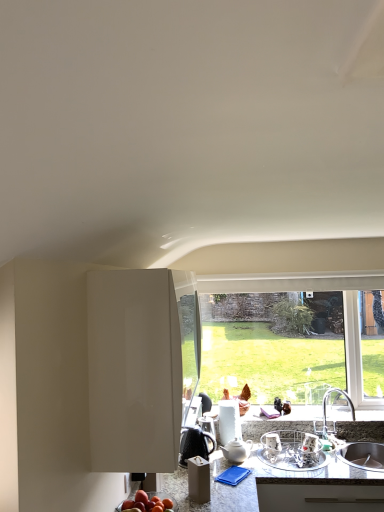
You are a GUI agent. You are given a task and a screenshot of the screen. Output one action in this format:
    pyautogui.click(x=<x>, y=<y>)
    Task: Click on the metallic silver dish rack at center, arranged as the 2th appliance when viewed from the left
    The height and width of the screenshot is (512, 384).
    Given the screenshot: What is the action you would take?
    pyautogui.click(x=291, y=453)

The image size is (384, 512). Describe the element at coordinates (146, 503) in the screenshot. I see `shiny red apple at lower center` at that location.

You are a GUI agent. You are given a task and a screenshot of the screen. Output one action in this format:
    pyautogui.click(x=<x>, y=<y>)
    Task: Click on the transparent glass window at center
    Image resolution: width=384 pixels, height=512 pixels.
    Given the screenshot: What is the action you would take?
    pyautogui.click(x=285, y=347)

Identify the location of metallic silver dish rack at center, the 1th appliance viewed from the right. This screenshot has height=512, width=384. (291, 453).

Is black glossy coffee pot at center, which ranks as the 1th appliance in left-to-right order, not close to granite gray countertop at lower center?

That's not correct — black glossy coffee pot at center, which ranks as the 1th appliance in left-to-right order, is a little close to granite gray countertop at lower center.

Is black glossy coffee pot at center, which ranks as the 1th appliance in left-to-right order, to the left or to the right of granite gray countertop at lower center in the image?

Clearly, black glossy coffee pot at center, which ranks as the 1th appliance in left-to-right order, is on the left of granite gray countertop at lower center in the image.

Which is behind, black glossy coffee pot at center, which ranks as the 1th appliance in left-to-right order, or granite gray countertop at lower center?

black glossy coffee pot at center, which ranks as the 1th appliance in left-to-right order.

Locate an element on the screen. The height and width of the screenshot is (512, 384). countertop that is under the black glossy coffee pot at center, acting as the second appliance starting from the right (from a real-world perspective) is located at coordinates (281, 484).

Does granite gray countertop at lower center contain shiny red apple at lower center?

No.

Considering the relative positions of granite gray countertop at lower center and shiny red apple at lower center in the image provided, is granite gray countertop at lower center behind shiny red apple at lower center?

That is True.

Are granite gray countertop at lower center and shiny red apple at lower center beside each other?

No, granite gray countertop at lower center is not next to shiny red apple at lower center.

Based on their positions, is granite gray countertop at lower center located to the left or right of shiny red apple at lower center?

granite gray countertop at lower center is to the right of shiny red apple at lower center.

In the scene shown: From a real-world perspective, relative to metallic silver dish rack at center, the 1th appliance viewed from the right, is white ceramic sink at lower right vertically above or below?

From a real-world perspective, white ceramic sink at lower right is physically above metallic silver dish rack at center, the 1th appliance viewed from the right.

Is white ceramic sink at lower right bigger than metallic silver dish rack at center, the 1th appliance viewed from the right?

Indeed, white ceramic sink at lower right has a larger size compared to metallic silver dish rack at center, the 1th appliance viewed from the right.

Where is `sink located above the metallic silver dish rack at center, arranged as the 2th appliance when viewed from the left (from a real-world perspective)`? The image size is (384, 512). sink located above the metallic silver dish rack at center, arranged as the 2th appliance when viewed from the left (from a real-world perspective) is located at coordinates (363, 455).

In the scene shown: Is white ceramic sink at lower right aimed at metallic silver dish rack at center, arranged as the 2th appliance when viewed from the left?

No, white ceramic sink at lower right does not turn towards metallic silver dish rack at center, arranged as the 2th appliance when viewed from the left.

Which of these two, white glossy teapot at center or white glossy cabinet at center, stands shorter?

With less height is white glossy teapot at center.

Based on their positions, is white glossy teapot at center located to the left or right of white glossy cabinet at center?

From the image, it's evident that white glossy teapot at center is to the right of white glossy cabinet at center.

In the scene shown: From a real-world perspective, is white glossy teapot at center on top of white glossy cabinet at center?

No.

Considering the relative sizes of white glossy teapot at center and white glossy cabinet at center in the image provided, is white glossy teapot at center thinner than white glossy cabinet at center?

Yes.

In terms of height, does white glossy teapot at center look taller or shorter compared to shiny red apple at lower center?

Considering their sizes, white glossy teapot at center has less height than shiny red apple at lower center.

From the image's perspective, which one is positioned higher, white glossy teapot at center or shiny red apple at lower center?

From the image's view, shiny red apple at lower center is above.

Is white glossy teapot at center wider than shiny red apple at lower center?

Incorrect, the width of white glossy teapot at center does not surpass that of shiny red apple at lower center.

Does white glossy teapot at center have a larger size compared to shiny red apple at lower center?

Incorrect, white glossy teapot at center is not larger than shiny red apple at lower center.

Could you measure the distance between white glossy cabinet at center and black glossy coffee pot at center, which ranks as the 1th appliance in left-to-right order?

They are 35.76 inches apart.

Is white glossy cabinet at center facing away from black glossy coffee pot at center, which ranks as the 1th appliance in left-to-right order?

No.

Is white glossy cabinet at center thinner than black glossy coffee pot at center, which ranks as the 1th appliance in left-to-right order?

In fact, white glossy cabinet at center might be wider than black glossy coffee pot at center, which ranks as the 1th appliance in left-to-right order.

From a real-world perspective, is white glossy cabinet at center physically located above or below black glossy coffee pot at center, which ranks as the 1th appliance in left-to-right order?

In terms of real-world spatial position, white glossy cabinet at center is above black glossy coffee pot at center, which ranks as the 1th appliance in left-to-right order.

Does shiny red apple at lower center turn towards white ceramic sink at lower right?

No, shiny red apple at lower center does not turn towards white ceramic sink at lower right.

How many degrees apart are the facing directions of shiny red apple at lower center and white ceramic sink at lower right?

The facing directions of shiny red apple at lower center and white ceramic sink at lower right are 90 degrees apart.

Can you confirm if shiny red apple at lower center is shorter than white ceramic sink at lower right?

Correct, shiny red apple at lower center is not as tall as white ceramic sink at lower right.

Is shiny red apple at lower center not within white ceramic sink at lower right?

That's correct, shiny red apple at lower center is outside of white ceramic sink at lower right.

This screenshot has width=384, height=512. Identify the location of the 2nd appliance behind the granite gray countertop at lower center, starting your count from the anchor. (195, 443).

Where is `countertop below the shiny red apple at lower center (from a real-world perspective)`? countertop below the shiny red apple at lower center (from a real-world perspective) is located at coordinates (281, 484).

Based on their spatial positions, is shiny red apple at lower center or transparent glass window at center further from granite gray countertop at lower center?

transparent glass window at center is positioned further to the anchor granite gray countertop at lower center.

In the scene shown: Looking at the image, which one is located closer to white glossy cabinet at center, black glossy coffee pot at center, acting as the second appliance starting from the right, or white ceramic sink at lower right?

black glossy coffee pot at center, acting as the second appliance starting from the right, lies closer to white glossy cabinet at center than the other object.

From the image, which object appears to be farther from white ceramic sink at lower right, black glossy coffee pot at center, which ranks as the 1th appliance in left-to-right order, or transparent glass window at center?

The object further to white ceramic sink at lower right is black glossy coffee pot at center, which ranks as the 1th appliance in left-to-right order.

When comparing their distances from shiny red apple at lower center, does granite gray countertop at lower center or metallic silver dish rack at center, arranged as the 2th appliance when viewed from the left, seem further?

Among the two, metallic silver dish rack at center, arranged as the 2th appliance when viewed from the left, is located further to shiny red apple at lower center.

From the image, which object appears to be farther from granite gray countertop at lower center, white glossy cabinet at center or white glossy teapot at center?

white glossy cabinet at center is further to granite gray countertop at lower center.

Estimate the real-world distances between objects in this image. Which object is further from granite gray countertop at lower center, white ceramic sink at lower right or transparent glass window at center?

transparent glass window at center is positioned further to the anchor granite gray countertop at lower center.

From the image, which object appears to be nearer to granite gray countertop at lower center, shiny red apple at lower center or white ceramic sink at lower right?

white ceramic sink at lower right is closer to granite gray countertop at lower center.

In the scene shown: Looking at the image, which one is located further to transparent glass window at center, white glossy cabinet at center or black glossy coffee pot at center, which ranks as the 1th appliance in left-to-right order?

The object further to transparent glass window at center is white glossy cabinet at center.

Where is `countertop between shiny red apple at lower center and metallic silver dish rack at center, arranged as the 2th appliance when viewed from the left, from left to right`? Image resolution: width=384 pixels, height=512 pixels. countertop between shiny red apple at lower center and metallic silver dish rack at center, arranged as the 2th appliance when viewed from the left, from left to right is located at coordinates (281, 484).

What are the coordinates of `countertop between white glossy cabinet at center and black glossy coffee pot at center, acting as the second appliance starting from the right, from front to back` in the screenshot? It's located at (281, 484).

Where is `tea pot between black glossy coffee pot at center, acting as the second appliance starting from the right, and white ceramic sink at lower right from left to right`? The height and width of the screenshot is (512, 384). tea pot between black glossy coffee pot at center, acting as the second appliance starting from the right, and white ceramic sink at lower right from left to right is located at coordinates (237, 450).

Locate an element on the screen. The image size is (384, 512). tea pot between shiny red apple at lower center and transparent glass window at center from front to back is located at coordinates (237, 450).